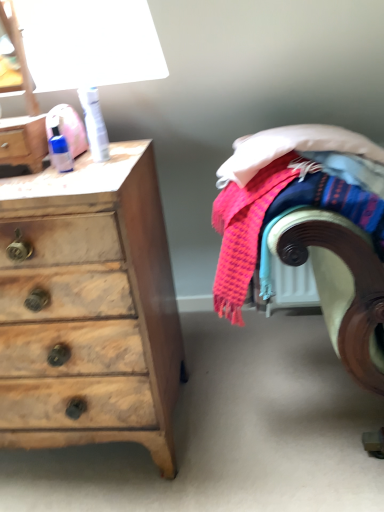
This screenshot has height=512, width=384. Identify the location of free space in front of white plastic can at upper left, placed as the first toiletry when sorted from right to left. (90, 174).